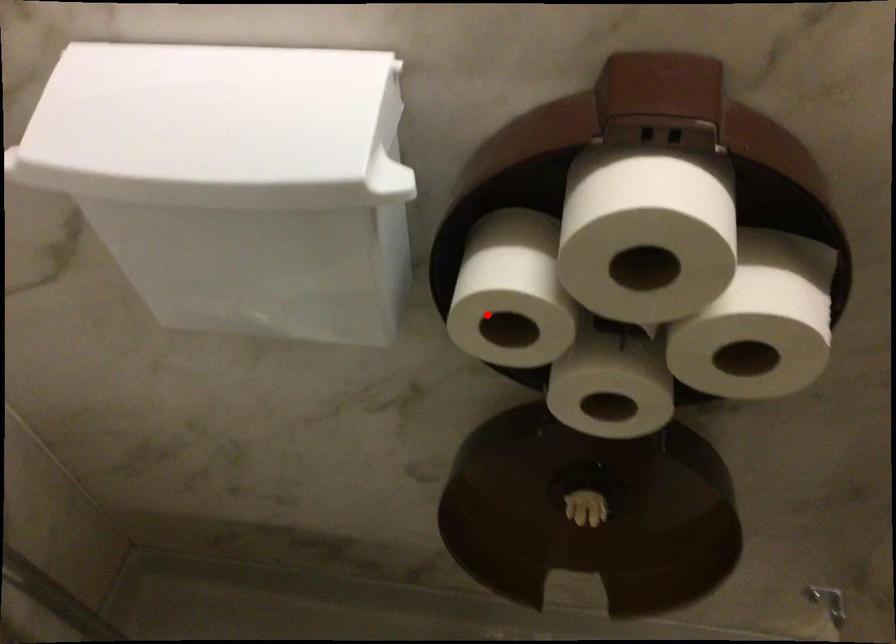
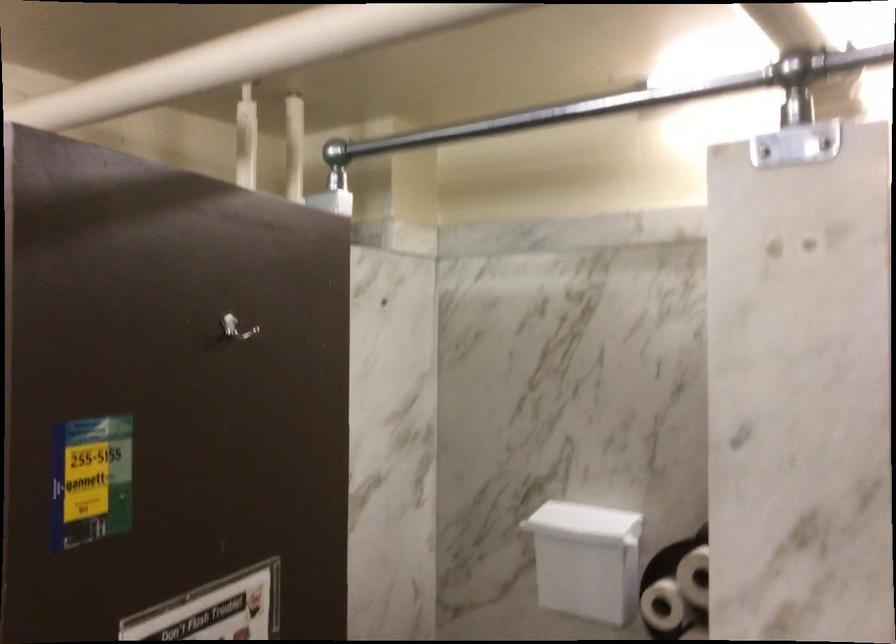
Question: I am providing you with two images of the same scene from different viewpoints. A red point is marked on the first image. At the location where the point appears in image 1, is it still visible in image 2?

Choices:
 (A) Yes
 (B) No

Answer: (A)